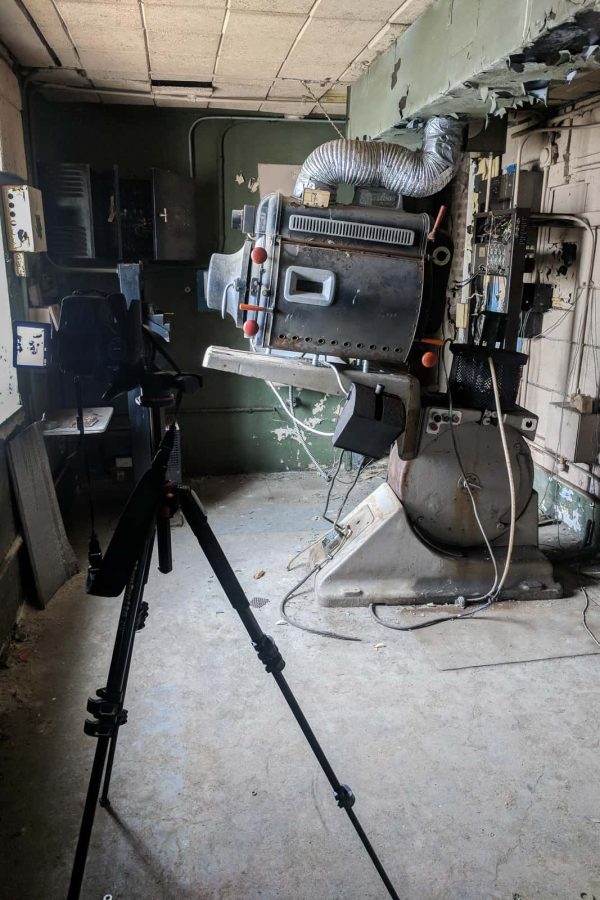
In order to click on long cords in this screenshot , I will do `click(447, 389)`, `click(491, 367)`.